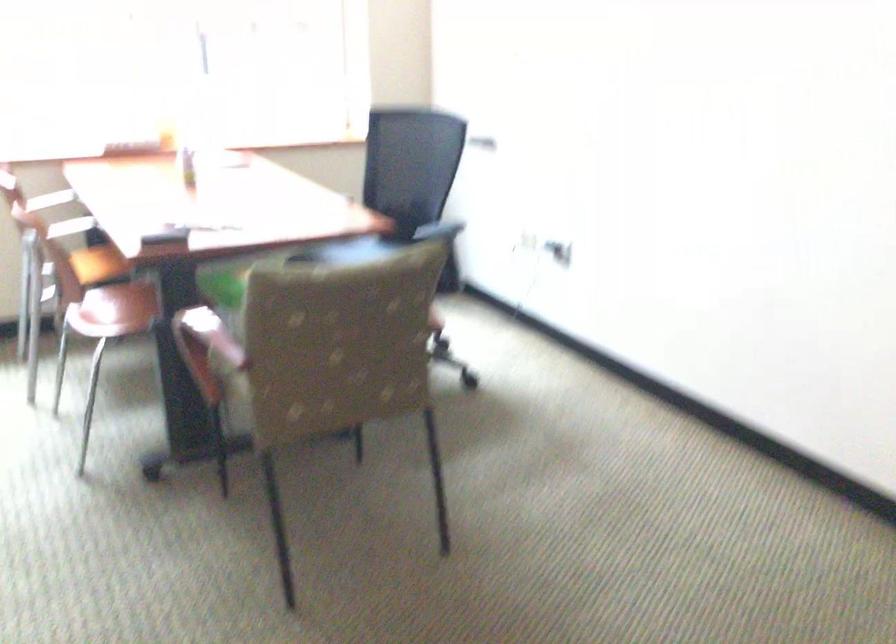
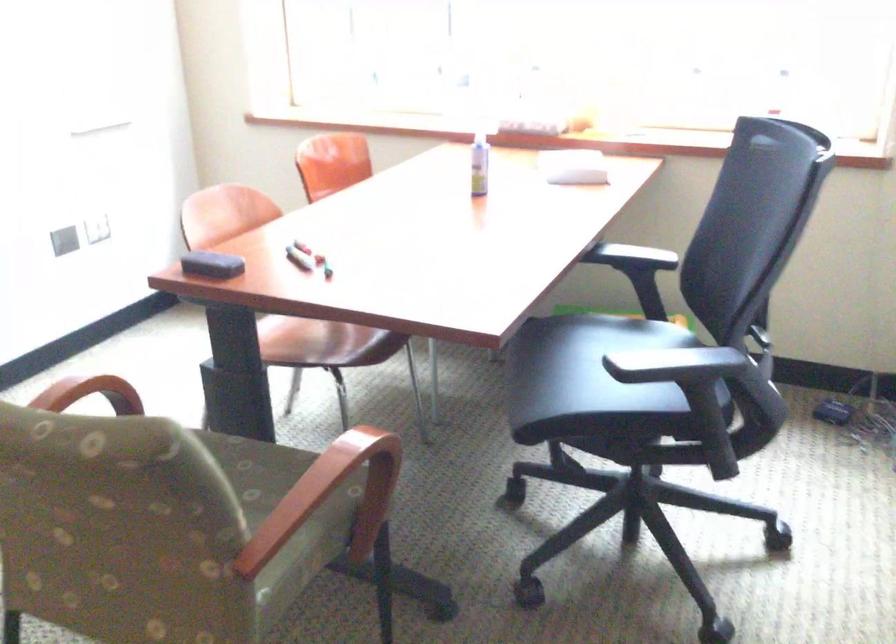
In the second image, find the point that corresponds to point 159,230 in the first image.

(211, 265)